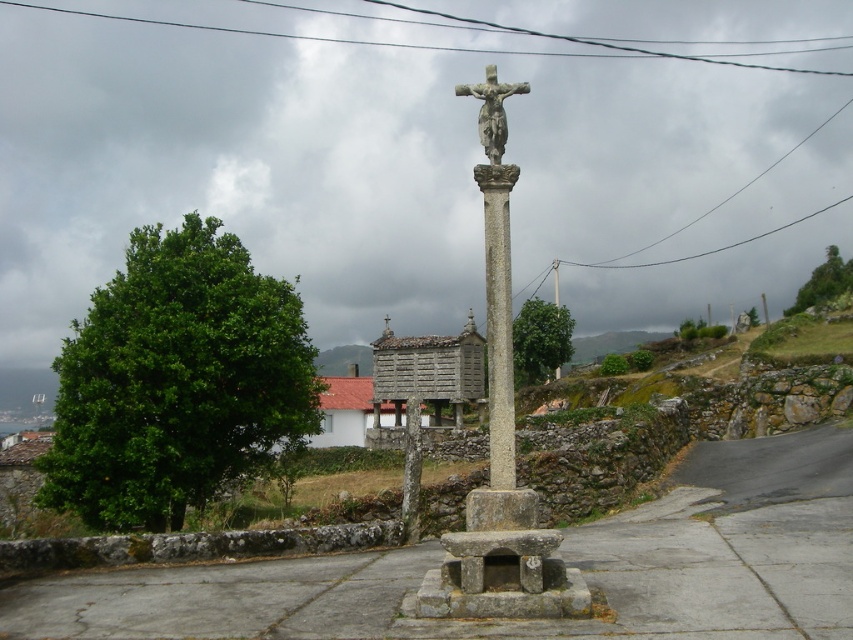
You are a tourist visiting this rural area and want to take a photo of both the stone statue at center and the stone cross at center. Since you can only focus on one object in your camera, which one should you choose to ensure both are visible in the frame?

The stone statue at center is larger than the stone cross at center, so you should focus on the stone statue at center to ensure both are visible in the frame.

You are standing at the entrance of the white building with a red roof and want to find the gray stone column at center. Based on your current position, in which general direction should you walk to reach it?

The gray stone column at center is located at coordinates (498, 321), so you should walk towards the center of the image from the entrance of the white building with a red roof to reach it.